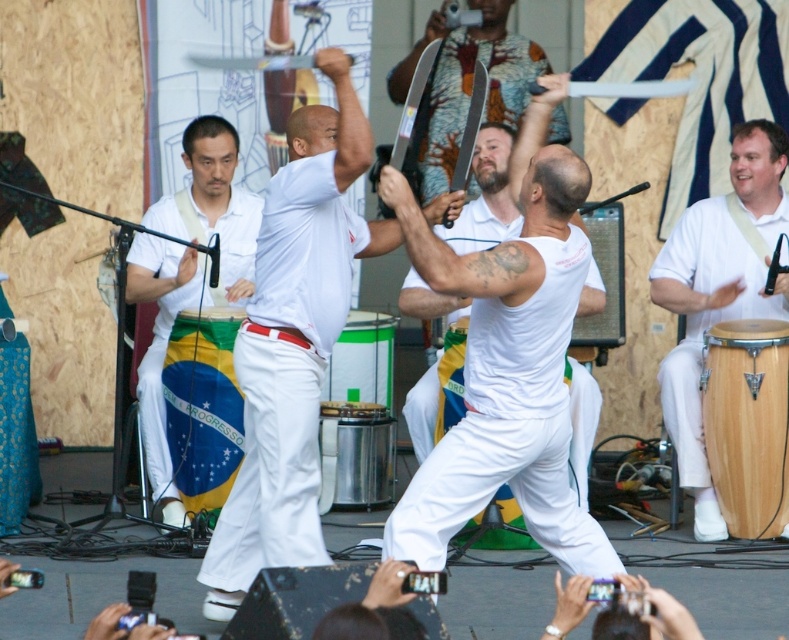
Between white cotton shirt at center and white cotton pants at center, which one appears on the right side from the viewer's perspective?

Positioned to the right is white cotton shirt at center.

Which is behind, point (354, 234) or point (133, 300)?

The point (133, 300) is behind.

Where is `white cotton shirt at center`? This screenshot has height=640, width=789. white cotton shirt at center is located at coordinates (294, 340).

Between point (189, 465) and point (387, 385), which one is positioned behind?

Point (387, 385)

Find the location of `white wooden drum at center`. white wooden drum at center is located at coordinates (204, 406).

Identify the location of white wooden drum at center. (204, 406).

Locate an element on the screen. white wood drum at right is located at coordinates (718, 291).

Between white wood drum at right and white wooden drum at center, which one is positioned higher?

white wood drum at right is higher up.

Does point (690, 228) come behind point (210, 344)?

That is True.

At what (x,y) coordinates should I click in order to perform the action: click on white wood drum at right. Please return your answer as a coordinate pair (x, y). The image size is (789, 640). Looking at the image, I should click on (718, 291).